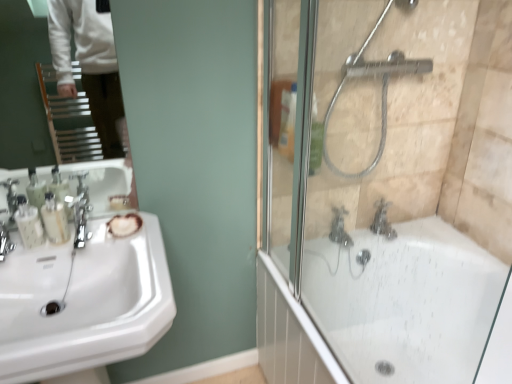
Question: Can you confirm if silver metallic showerhead at upper right is taller than polished chrome faucet at left, the 1th faucet viewed from the right?

Choices:
 (A) no
 (B) yes

Answer: (B)

Question: Is silver metallic showerhead at upper right closer to camera compared to polished chrome faucet at left, the 2th faucet viewed from the left?

Choices:
 (A) no
 (B) yes

Answer: (B)

Question: Does silver metallic showerhead at upper right have a lesser width compared to polished chrome faucet at left, the 2th faucet viewed from the left?

Choices:
 (A) yes
 (B) no

Answer: (B)

Question: From a real-world perspective, is silver metallic showerhead at upper right beneath polished chrome faucet at left, the 1th faucet viewed from the right?

Choices:
 (A) yes
 (B) no

Answer: (B)

Question: From a real-world perspective, is silver metallic showerhead at upper right on top of polished chrome faucet at left, the 1th faucet viewed from the right?

Choices:
 (A) no
 (B) yes

Answer: (B)

Question: Would you say translucent plastic soap dispenser at left, positioned as the first toiletry in right-to-left order, is to the left or to the right of silver metallic showerhead at upper right in the picture?

Choices:
 (A) right
 (B) left

Answer: (B)

Question: Would you say translucent plastic soap dispenser at left, the second toiletry from the left, is inside or outside silver metallic showerhead at upper right?

Choices:
 (A) outside
 (B) inside

Answer: (A)

Question: Is translucent plastic soap dispenser at left, the second toiletry from the left, wider or thinner than silver metallic showerhead at upper right?

Choices:
 (A) wide
 (B) thin

Answer: (B)

Question: Is point (53, 221) positioned closer to the camera than point (343, 67)?

Choices:
 (A) closer
 (B) farther

Answer: (A)

Question: Is point (378, 200) positioned closer to the camera than point (79, 241)?

Choices:
 (A) farther
 (B) closer

Answer: (A)

Question: In the image, is satin nickel faucet at lower right, the 2th tap viewed from the left, on the left side or the right side of polished chrome faucet at left, the 1th faucet viewed from the right?

Choices:
 (A) right
 (B) left

Answer: (A)

Question: Which is correct: satin nickel faucet at lower right, the 2th tap viewed from the left, is inside polished chrome faucet at left, the 2th faucet viewed from the left, or outside of it?

Choices:
 (A) outside
 (B) inside

Answer: (A)

Question: Considering their positions, is satin nickel faucet at lower right, the 2th tap viewed from the left, located in front of or behind polished chrome faucet at left, the 1th faucet viewed from the right?

Choices:
 (A) behind
 (B) front

Answer: (A)

Question: From the image's perspective, relative to satin nickel faucet at lower right, the 2th tap viewed from the left, is white glossy bathtub at right above or below?

Choices:
 (A) above
 (B) below

Answer: (B)

Question: From their relative heights in the image, would you say white glossy bathtub at right is taller or shorter than satin nickel faucet at lower right, arranged as the first tap when viewed from the right?

Choices:
 (A) tall
 (B) short

Answer: (A)